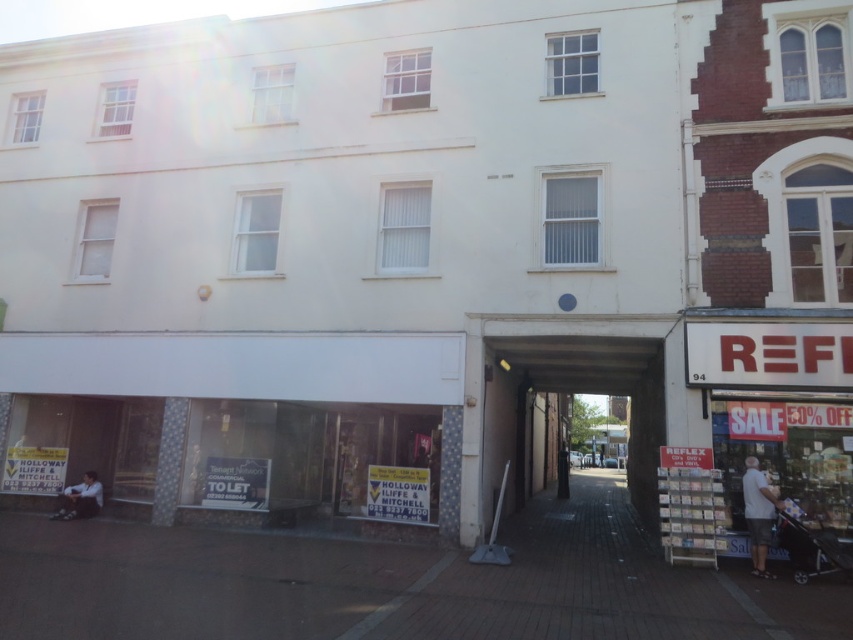
Question: Is white cotton shirt at lower right further to camera compared to dark gray jeans at lower left?

Choices:
 (A) yes
 (B) no

Answer: (B)

Question: Is white cotton shirt at lower right positioned at the back of dark gray jeans at lower left?

Choices:
 (A) no
 (B) yes

Answer: (A)

Question: Which object is farther from the camera taking this photo?

Choices:
 (A) white cotton shirt at lower right
 (B) dark gray jeans at lower left

Answer: (B)

Question: Which of the following is the farthest from the observer?

Choices:
 (A) dark gray jeans at lower left
 (B) white cotton shirt at lower right

Answer: (A)

Question: Is white cotton shirt at lower right smaller than dark gray jeans at lower left?

Choices:
 (A) no
 (B) yes

Answer: (A)